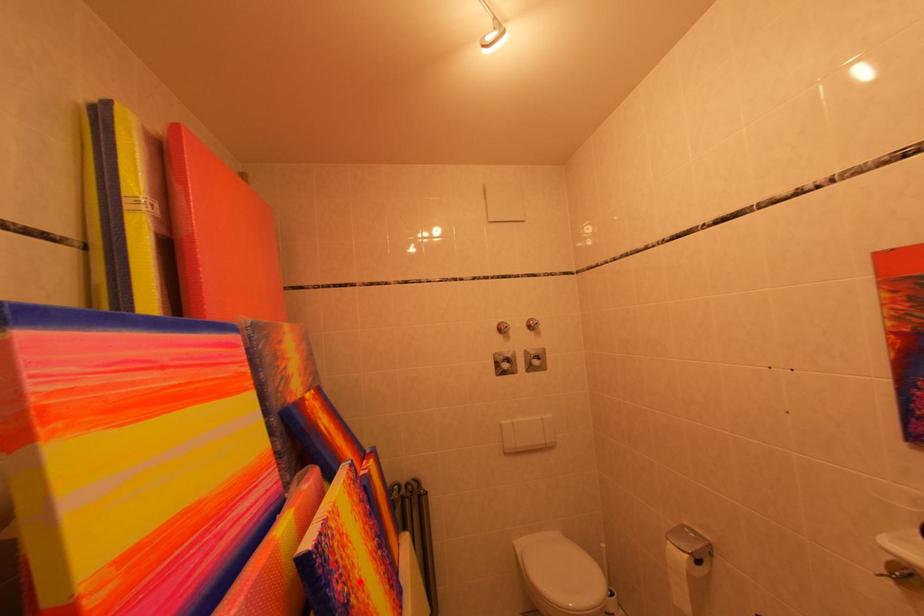
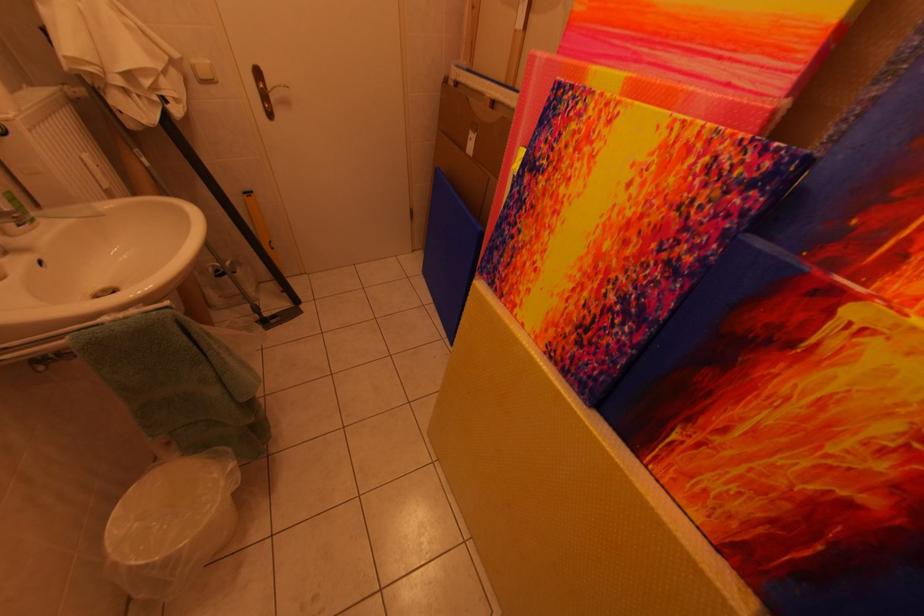
Question: I am providing you with two images of the same scene from different viewpoints. A red point is marked on the first image. At the location where the point appears in image 1, is it still visible in image 2?

Choices:
 (A) Yes
 (B) No

Answer: (A)